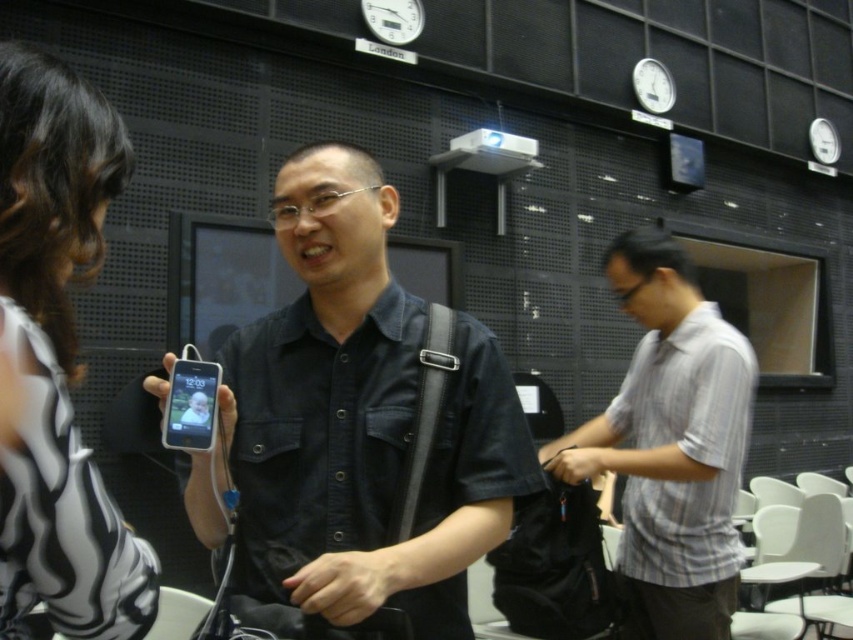
Is white printed blouse at upper left in front of gray striped shirt at right?

Yes.

Between white printed blouse at upper left and gray striped shirt at right, which one appears on the left side from the viewer's perspective?

white printed blouse at upper left

Does point (68, 433) come in front of point (677, 531)?

Yes, point (68, 433) is closer to viewer.

The image size is (853, 640). I want to click on white printed blouse at upper left, so click(56, 358).

Describe the element at coordinates (361, 419) in the screenshot. I see `black denim shirt at center` at that location.

Which is more to the right, black denim shirt at center or white printed blouse at upper left?

Positioned to the right is black denim shirt at center.

This screenshot has height=640, width=853. In order to click on black denim shirt at center in this screenshot , I will do `click(361, 419)`.

Does black denim shirt at center appear on the right side of gray striped shirt at right?

Incorrect, black denim shirt at center is not on the right side of gray striped shirt at right.

This screenshot has width=853, height=640. What do you see at coordinates (361, 419) in the screenshot? I see `black denim shirt at center` at bounding box center [361, 419].

Identify the location of black denim shirt at center. (361, 419).